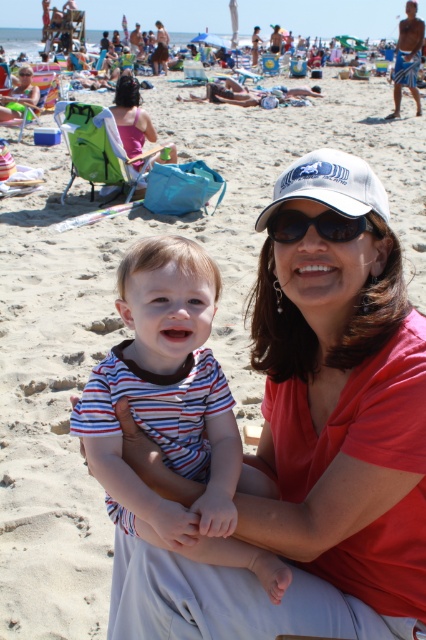
Does white mesh baseball cap at center appear on the right side of matte black sunglasses at upper left?

Indeed, white mesh baseball cap at center is positioned on the right side of matte black sunglasses at upper left.

Can you confirm if white mesh baseball cap at center is shorter than matte black sunglasses at upper left?

Indeed, white mesh baseball cap at center has a lesser height compared to matte black sunglasses at upper left.

At what (x,y) coordinates should I click in order to perform the action: click on white mesh baseball cap at center. Please return your answer as a coordinate pair (x, y). This screenshot has height=640, width=426. Looking at the image, I should click on (330, 186).

This screenshot has width=426, height=640. Identify the location of white mesh baseball cap at center. (330, 186).

Can you confirm if striped cotton shirt at center is thinner than white mesh baseball cap at center?

In fact, striped cotton shirt at center might be wider than white mesh baseball cap at center.

Can you confirm if striped cotton shirt at center is positioned to the right of white mesh baseball cap at center?

In fact, striped cotton shirt at center is to the left of white mesh baseball cap at center.

Where is `striped cotton shirt at center`? Image resolution: width=426 pixels, height=640 pixels. striped cotton shirt at center is located at coordinates (170, 410).

Who is positioned more to the right, black plastic sunglasses at center or pink fabric chair at upper left?

black plastic sunglasses at center is more to the right.

Where is `black plastic sunglasses at center`? black plastic sunglasses at center is located at coordinates (316, 225).

At what (x,y) coordinates should I click in order to perform the action: click on black plastic sunglasses at center. Please return your answer as a coordinate pair (x, y). Looking at the image, I should click on (316, 225).